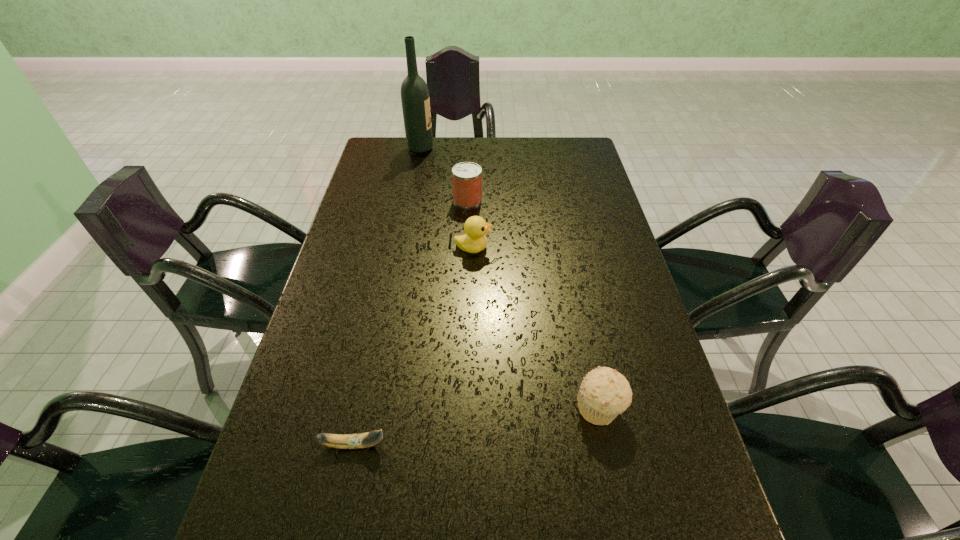
Where is `wine bottle`? The height and width of the screenshot is (540, 960). wine bottle is located at coordinates (415, 99).

You are a GUI agent. You are given a task and a screenshot of the screen. Output one action in this format:
    pyautogui.click(x=<x>, y=<y>)
    Task: Click on the farthest object
    The image size is (960, 540).
    Given the screenshot: What is the action you would take?
    pyautogui.click(x=415, y=99)

This screenshot has height=540, width=960. In order to click on the second farthest object in this screenshot , I will do `click(467, 176)`.

This screenshot has width=960, height=540. What are the coordinates of `the third nearest object` in the screenshot? It's located at (475, 227).

Find the location of a particular element. muffin is located at coordinates (604, 393).

You are a GUI agent. You are given a task and a screenshot of the screen. Output one action in this format:
    pyautogui.click(x=<x>, y=<y>)
    Task: Click on the rightmost object
    The width and height of the screenshot is (960, 540).
    Given the screenshot: What is the action you would take?
    pyautogui.click(x=604, y=393)

You are a GUI agent. You are given a task and a screenshot of the screen. Output one action in this format:
    pyautogui.click(x=<x>, y=<y>)
    Task: Click on the nearest object
    The image size is (960, 540).
    Given the screenshot: What is the action you would take?
    pyautogui.click(x=362, y=440)

Where is `the shortest object`? The height and width of the screenshot is (540, 960). the shortest object is located at coordinates (362, 440).

Locate an element on the screen. Image resolution: width=960 pixels, height=540 pixels. vacant position located 0.390m on the labeled side of the tallest object is located at coordinates (536, 148).

The height and width of the screenshot is (540, 960). What are the coordinates of `free space located 0.230m on the right of the can` in the screenshot? It's located at (552, 200).